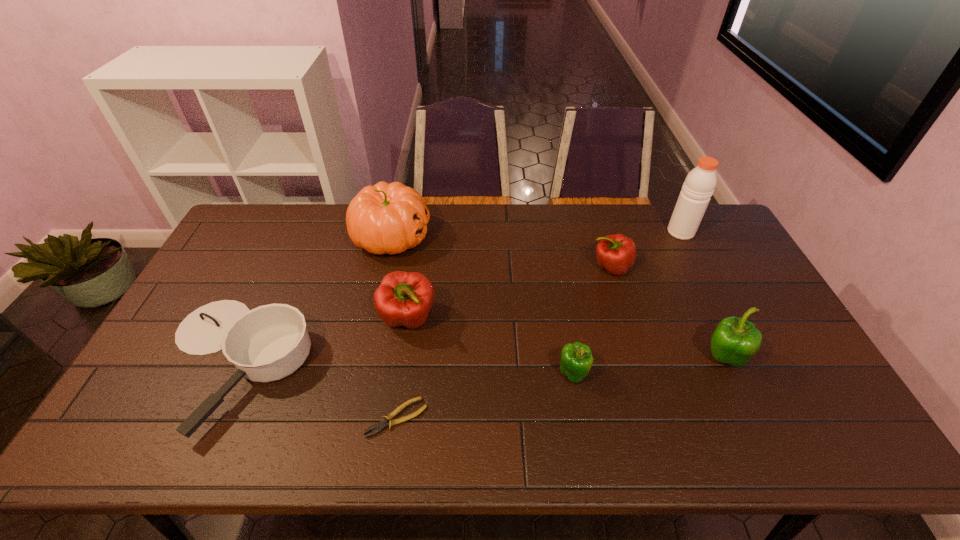
I want to click on vacant position in the image that satisfies the following two spatial constraints: 1. on the carved face of the orange pumpkin; 2. on the right side of the left pink bell pepper, so click(x=373, y=319).

Locate an element on the screen. free spot that satisfies the following two spatial constraints: 1. on the carved face of the bigger pink bell pepper; 2. on the left side of the orange pumpkin is located at coordinates (373, 319).

Locate an element on the screen. This screenshot has width=960, height=540. vacant space that satisfies the following two spatial constraints: 1. on the front side of the rightmost bell pepper; 2. on the right side of the nearer pink bell pepper is located at coordinates (402, 359).

I want to click on free space that satisfies the following two spatial constraints: 1. on the front side of the right pink bell pepper; 2. on the right side of the bigger green bell pepper, so point(638,359).

This screenshot has width=960, height=540. What are the coordinates of `vacant area in the image that satisfies the following two spatial constraints: 1. on the back side of the saucepan; 2. on the left side of the nearer pink bell pepper` in the screenshot? It's located at (254, 319).